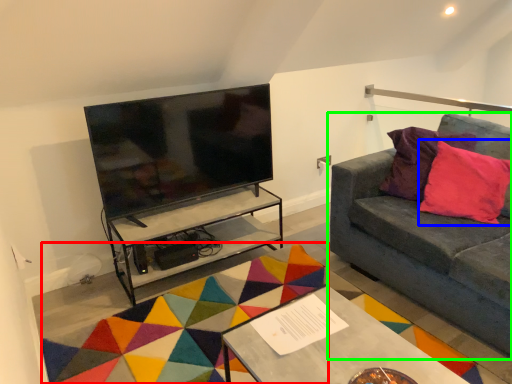
Question: Which is farther away from mat (highlighted by a red box)? throw pillow (highlighted by a blue box) or studio couch (highlighted by a green box)?

Choices:
 (A) throw pillow
 (B) studio couch

Answer: (A)